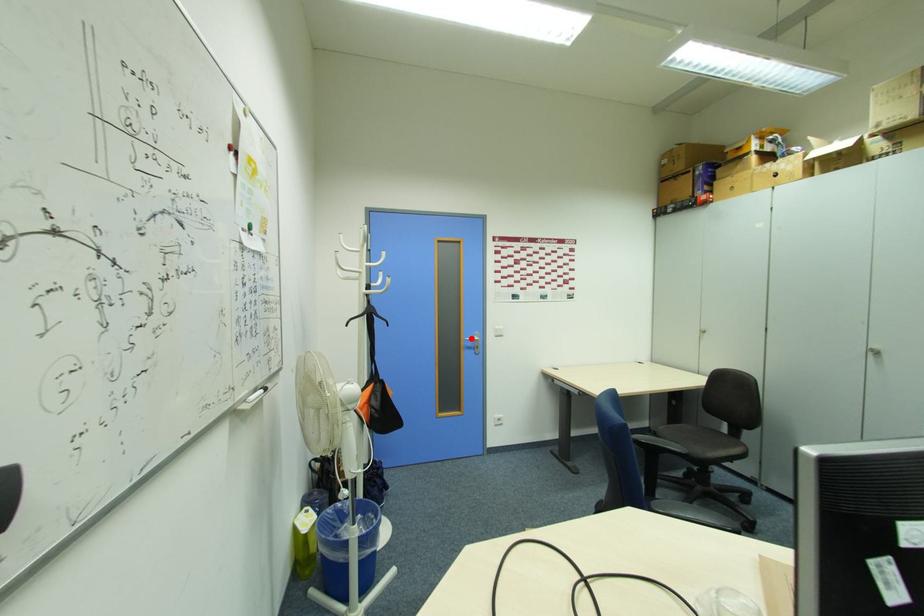
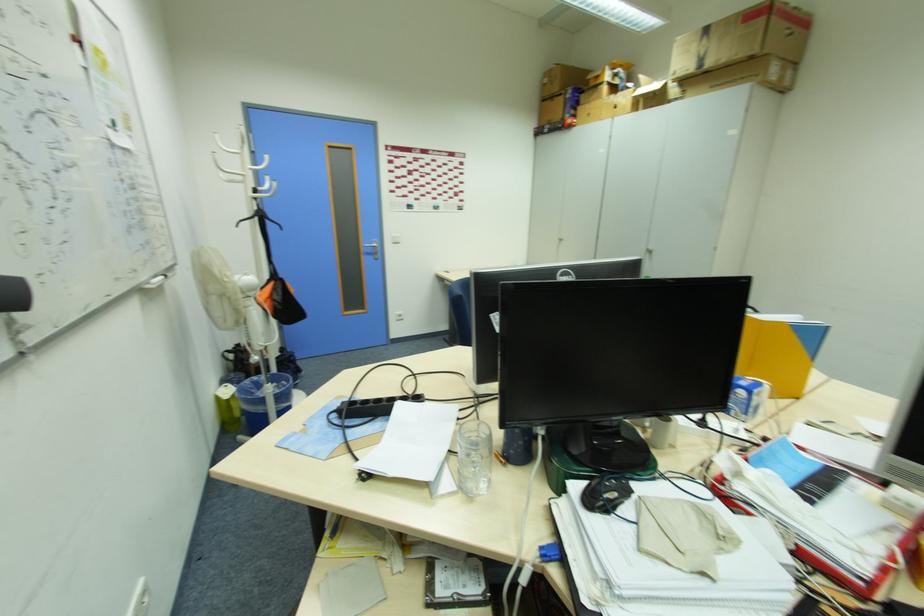
Question: I am providing you with two images of the same scene from different viewpoints. A red point is shown in image1. For the corresponding object point in image2, is it positioned nearer or farther from the camera?

Choices:
 (A) Nearer
 (B) Farther

Answer: (A)